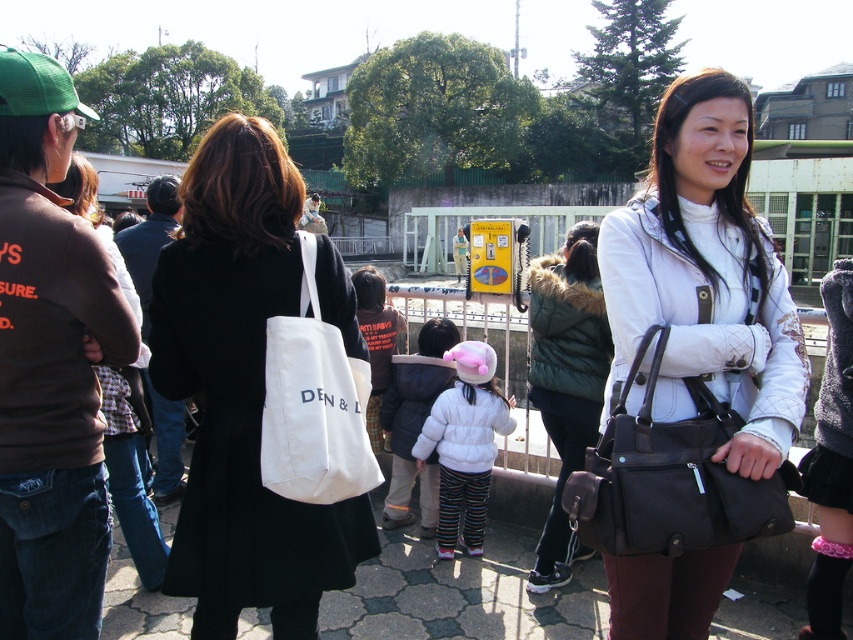
Who is higher up, white canvas tote at center or white fluffy coat at center?

Positioned higher is white canvas tote at center.

Can you confirm if white canvas tote at center is positioned to the left of white fluffy coat at center?

Indeed, white canvas tote at center is positioned on the left side of white fluffy coat at center.

Is point (346, 486) less distant than point (450, 536)?

Yes, point (346, 486) is in front of point (450, 536).

Where is `white canvas tote at center`? This screenshot has height=640, width=853. white canvas tote at center is located at coordinates (312, 403).

Is the position of black leather handbag at center-right less distant than that of green fuzzy vest at center?

Yes, black leather handbag at center-right is closer to the viewer.

Does point (666, 545) lie behind point (566, 308)?

That is False.

The width and height of the screenshot is (853, 640). Describe the element at coordinates (670, 477) in the screenshot. I see `black leather handbag at center-right` at that location.

You are a GUI agent. You are given a task and a screenshot of the screen. Output one action in this format:
    pyautogui.click(x=<x>, y=<y>)
    Task: Click on the black leather handbag at center-right
    Image resolution: width=853 pixels, height=640 pixels.
    Given the screenshot: What is the action you would take?
    pyautogui.click(x=670, y=477)

Which is more to the left, green fabric baseball cap at upper left or pink plush baseball hat at center?

Positioned to the left is green fabric baseball cap at upper left.

Looking at this image, does green fabric baseball cap at upper left have a lesser height compared to pink plush baseball hat at center?

Incorrect, green fabric baseball cap at upper left's height does not fall short of pink plush baseball hat at center's.

Identify the location of green fabric baseball cap at upper left. (36, 86).